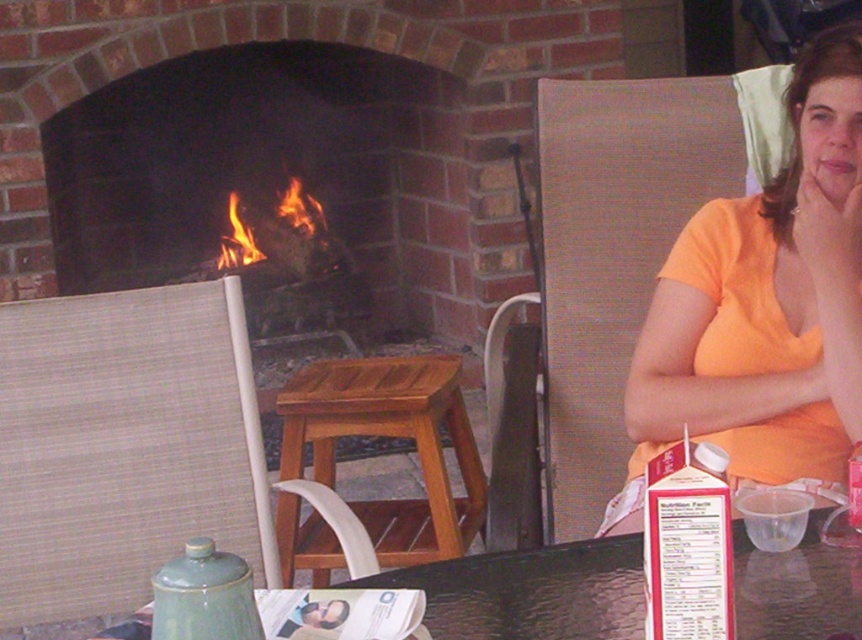
How far apart are orange cotton shirt at upper right and wooden stool at center?

orange cotton shirt at upper right and wooden stool at center are 26.14 inches apart.

Is point (826, 333) positioned in front of point (432, 355)?

That is True.

Identify the location of orange cotton shirt at upper right. This screenshot has height=640, width=862. (764, 307).

Does point (478, 618) lie in front of point (276, 246)?

Yes, it is.

Is point (629, 570) farther from camera compared to point (294, 195)?

No, (629, 570) is closer to viewer.

Is point (542, 580) closer to viewer compared to point (228, 252)?

Yes, point (542, 580) is in front of point (228, 252).

Locate an element on the screen. black glossy table at lower center is located at coordinates (529, 593).

Is orange cotton shirt at upper right in front of flamewooden" at "center?

Yes, orange cotton shirt at upper right is closer to the viewer.

Measure the distance between point (679, 381) and camera.

A distance of 1.93 meters exists between point (679, 381) and camera.

Does point (772, 454) come behind point (265, 259)?

No, (772, 454) is closer to viewer.

Where is `orange cotton shirt at upper right`? This screenshot has height=640, width=862. orange cotton shirt at upper right is located at coordinates (764, 307).